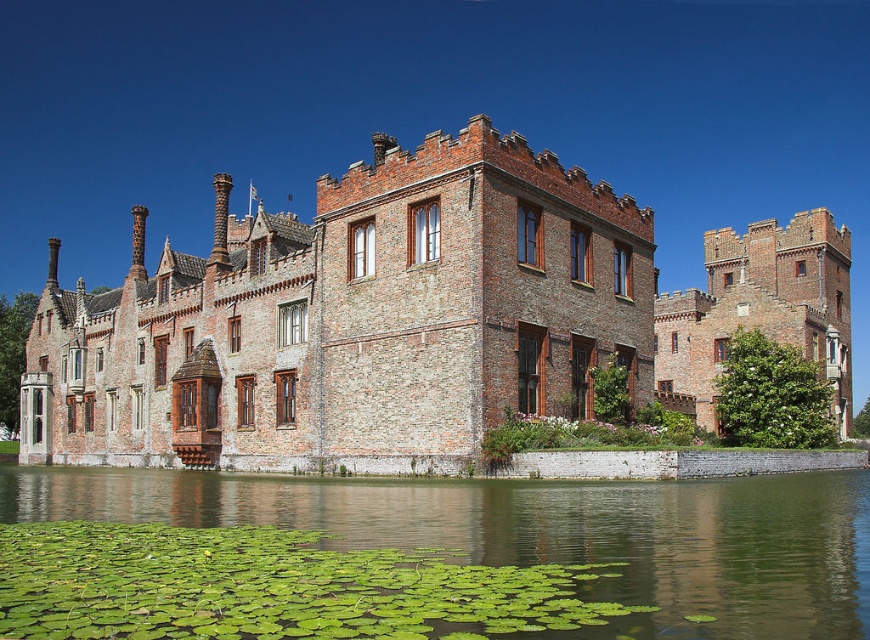
Question: Which object appears farthest from the camera in this image?

Choices:
 (A) green leafy water at lower center
 (B) brown brick castle at center

Answer: (B)

Question: Can you confirm if brown brick castle at center is wider than green leafy water at lower center?

Choices:
 (A) yes
 (B) no

Answer: (A)

Question: Does brown brick castle at center have a lesser width compared to green leafy water at lower center?

Choices:
 (A) no
 (B) yes

Answer: (A)

Question: Can you confirm if brown brick castle at center is positioned below green leafy water at lower center?

Choices:
 (A) no
 (B) yes

Answer: (A)

Question: Which object is farther from the camera taking this photo?

Choices:
 (A) green leafy water at lower center
 (B) brown brick castle at center

Answer: (B)